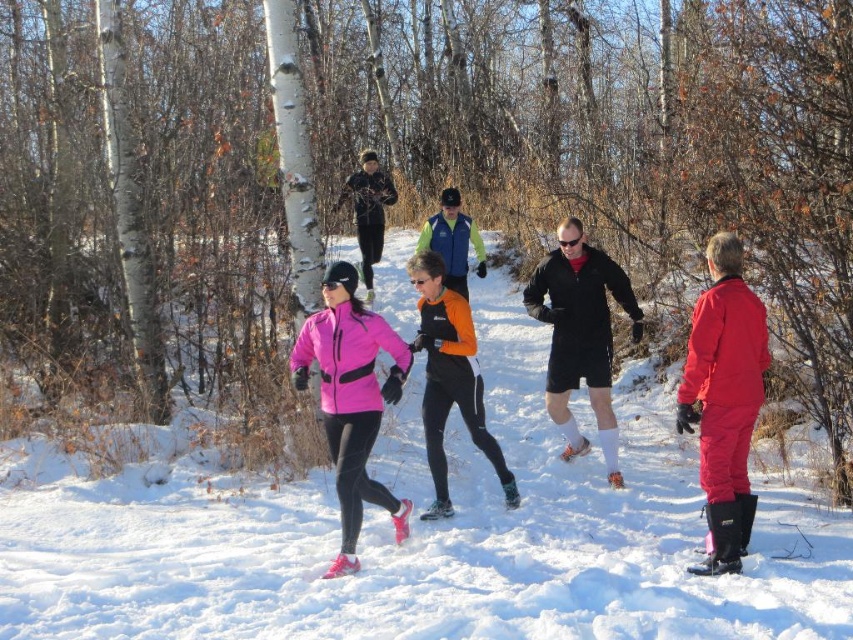
Question: Which is farther from the matte blue vest at center?

Choices:
 (A) orange matte jacket at center
 (B) matte red snowsuit at right

Answer: (B)

Question: Does matte red snowsuit at right come in front of orange matte jacket at center?

Choices:
 (A) no
 (B) yes

Answer: (B)

Question: Which point is closer to the camera?

Choices:
 (A) (459, 280)
 (B) (360, 243)

Answer: (A)

Question: Based on their relative distances, which object is farther from the black matte shorts at center?

Choices:
 (A) matte blue vest at center
 (B) matte red snowsuit at right
 (C) matte black jacket at center
 (D) orange matte jacket at center

Answer: (C)

Question: Is white fluffy snow at center smaller than matte pink jacket at center?

Choices:
 (A) yes
 (B) no

Answer: (A)

Question: Does orange matte jacket at center appear over matte black jacket at center?

Choices:
 (A) no
 (B) yes

Answer: (A)